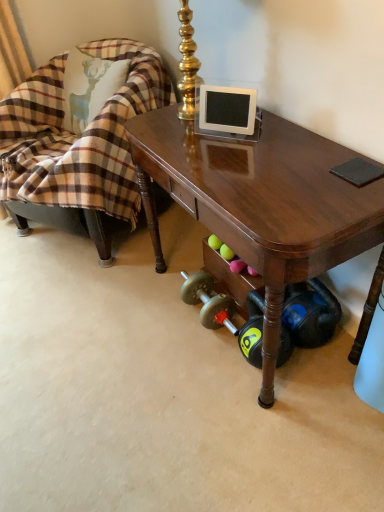
Describe the element at coordinates (77, 145) in the screenshot. This screenshot has height=512, width=384. I see `plaid fabric chair at left` at that location.

The image size is (384, 512). Identify the location of plaid fabric chair at left. (77, 145).

The width and height of the screenshot is (384, 512). What do you see at coordinates (260, 202) in the screenshot?
I see `shiny brown desk at center` at bounding box center [260, 202].

The height and width of the screenshot is (512, 384). Find the location of `shiny brown desk at center`. shiny brown desk at center is located at coordinates (260, 202).

Where is `plaid fabric chair at left`? This screenshot has height=512, width=384. plaid fabric chair at left is located at coordinates (77, 145).

Considering the relative positions of plaid fabric chair at left and shiny brown desk at center in the image provided, is plaid fabric chair at left to the left of shiny brown desk at center from the viewer's perspective?

Yes, plaid fabric chair at left is to the left of shiny brown desk at center.

Which is behind, plaid fabric chair at left or shiny brown desk at center?

Positioned behind is plaid fabric chair at left.

Considering the positions of point (65, 196) and point (161, 151), is point (65, 196) closer or farther from the camera than point (161, 151)?

Clearly, point (65, 196) is more distant from the camera than point (161, 151).

From the image's perspective, is plaid fabric chair at left located above or below shiny brown desk at center?

Based on their image positions, plaid fabric chair at left is located above shiny brown desk at center.

From a real-world perspective, which is physically above, plaid fabric chair at left or shiny brown desk at center?

In real-world perspective, plaid fabric chair at left is above.

Is plaid fabric chair at left wider than shiny brown desk at center?

Indeed, plaid fabric chair at left has a greater width compared to shiny brown desk at center.

In terms of height, does plaid fabric chair at left look taller or shorter compared to shiny brown desk at center?

Considering their sizes, plaid fabric chair at left has more height than shiny brown desk at center.

Which of these two, plaid fabric chair at left or shiny brown desk at center, is smaller?

shiny brown desk at center is smaller.

Would you say plaid fabric chair at left is inside or outside shiny brown desk at center?

plaid fabric chair at left is not inside shiny brown desk at center, it's outside.

Is plaid fabric chair at left placed right next to shiny brown desk at center?

No, plaid fabric chair at left is not making contact with shiny brown desk at center.

Does plaid fabric chair at left turn towards shiny brown desk at center?

No, plaid fabric chair at left does not turn towards shiny brown desk at center.

Can you tell me how much plaid fabric chair at left and shiny brown desk at center differ in facing direction?

The angle between the facing direction of plaid fabric chair at left and the facing direction of shiny brown desk at center is 29 degrees.

This screenshot has height=512, width=384. What are the coordinates of `chair above the shiny brown desk at center (from a real-world perspective)` in the screenshot? It's located at (77, 145).

From the picture: Based on their positions, is shiny brown desk at center located to the left or right of plaid fabric chair at left?

From the image, it's evident that shiny brown desk at center is to the right of plaid fabric chair at left.

Is shiny brown desk at center behind plaid fabric chair at left?

No.

Considering the points (162, 253) and (101, 158), which point is behind, point (162, 253) or point (101, 158)?

Point (162, 253)

From the image's perspective, is shiny brown desk at center positioned above or below plaid fabric chair at left?

From the image's perspective, shiny brown desk at center appears below plaid fabric chair at left.

From a real-world perspective, who is located lower, shiny brown desk at center or plaid fabric chair at left?

shiny brown desk at center, from a real-world perspective.

Is shiny brown desk at center wider or thinner than plaid fabric chair at left?

shiny brown desk at center is thinner than plaid fabric chair at left.

From their relative heights in the image, would you say shiny brown desk at center is taller or shorter than plaid fabric chair at left?

Considering their sizes, shiny brown desk at center has less height than plaid fabric chair at left.

Considering the relative sizes of shiny brown desk at center and plaid fabric chair at left in the image provided, is shiny brown desk at center bigger than plaid fabric chair at left?

Actually, shiny brown desk at center might be smaller than plaid fabric chair at left.

Can plaid fabric chair at left be found inside shiny brown desk at center?

No.

Are shiny brown desk at center and plaid fabric chair at left far apart?

No.

Is shiny brown desk at center facing away from plaid fabric chair at left?

No.

Measure the distance from shiny brown desk at center to plaid fabric chair at left.

The distance of shiny brown desk at center from plaid fabric chair at left is 20.57 inches.

The image size is (384, 512). There is a shiny brown desk at center. What are the coordinates of `chair above it (from a real-world perspective)` in the screenshot? It's located at (77, 145).

Find the location of a particular element. chair behind the shiny brown desk at center is located at coordinates (77, 145).

The image size is (384, 512). Find the location of `desk beneath the plaid fabric chair at left (from a real-world perspective)`. desk beneath the plaid fabric chair at left (from a real-world perspective) is located at coordinates (260, 202).